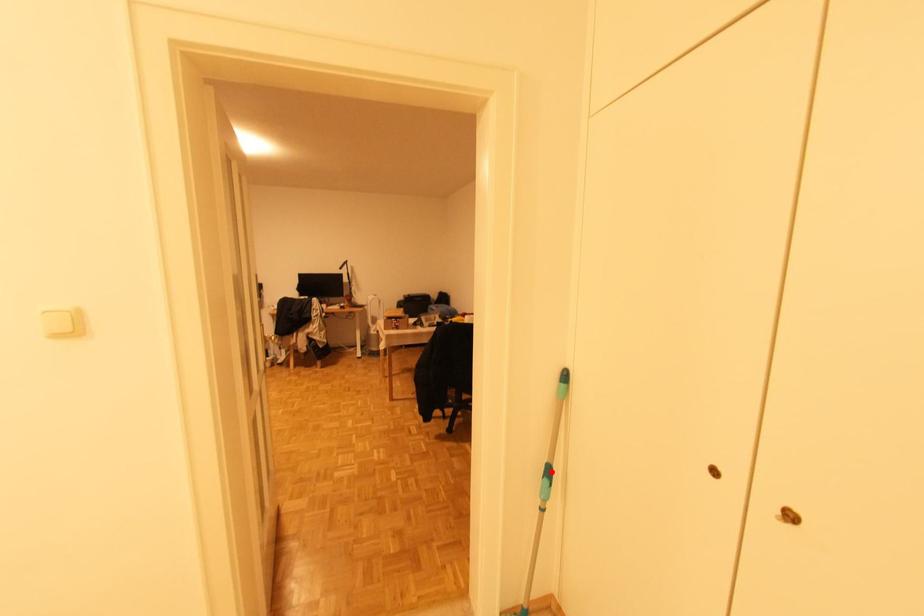
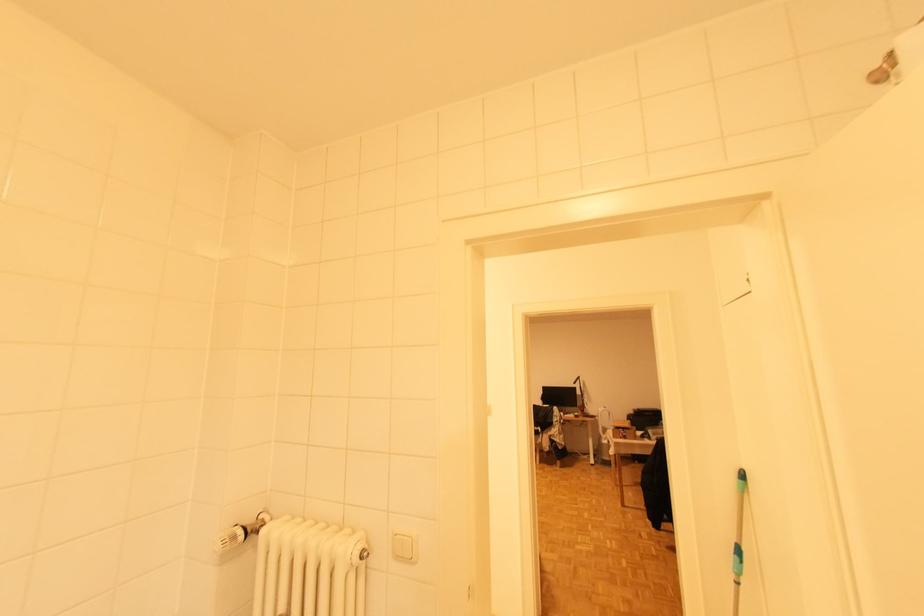
Question: I am providing you with two images of the same scene from different viewpoints. A red point is shown in image1. For the corresponding object point in image2, is it positioned nearer or farther from the camera?

Choices:
 (A) Nearer
 (B) Farther

Answer: (A)